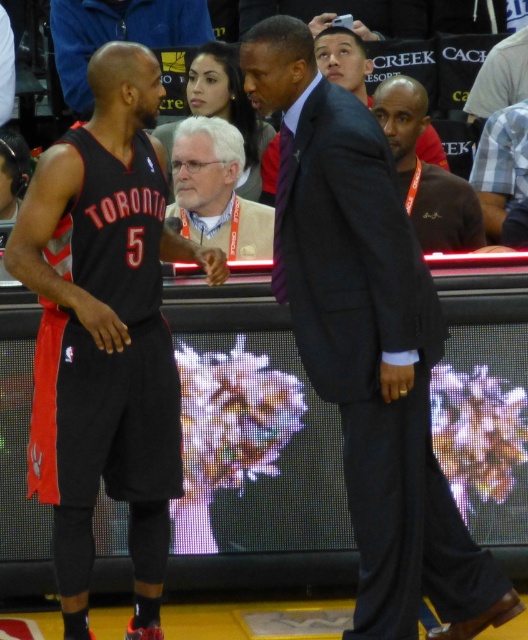
Question: Does white textured shirt at center appear on the right side of black jersey at center?

Choices:
 (A) no
 (B) yes

Answer: (B)

Question: Is dark brown suit at center smaller than blue plaid shirt at right?

Choices:
 (A) yes
 (B) no

Answer: (A)

Question: Is the position of matte black jersey at left less distant than that of white textured shirt at center?

Choices:
 (A) yes
 (B) no

Answer: (A)

Question: Which of these objects is positioned farthest from the matte black jersey at left?

Choices:
 (A) blue plaid shirt at right
 (B) black jersey at center

Answer: (B)

Question: Which of the following is the farthest from the observer?

Choices:
 (A) dark brown suit at center
 (B) dark gray suit at center

Answer: (A)

Question: Which of the following is the closest to the observer?

Choices:
 (A) black jersey at center
 (B) dark gray suit at center

Answer: (B)